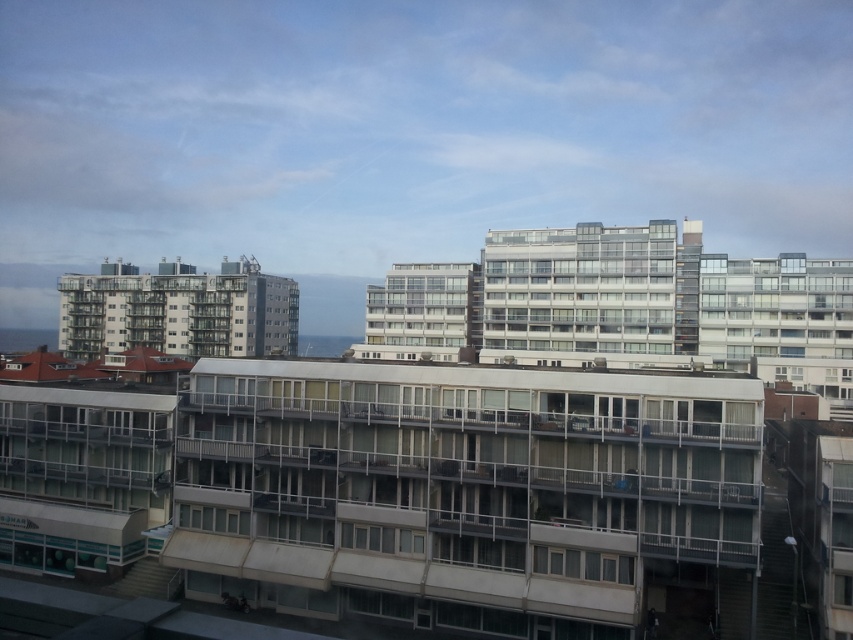
You are standing on the street in front of the residential area. You see the white concrete building at center and the matte glass building at left. Which building is closer to the ground?

The white concrete building at center is located below the matte glass building at left, so it is closer to the ground.

You are an urban planner evaluating this residential area. You need to determine which building, the white concrete building at center or the matte glass building at left, has a greater floor area. Based on the information provided, which one would you choose?

The matte glass building at left is larger than the white concrete building at center, so it likely has a greater floor area.

You are standing in the residential area and want to take a photo of the white concrete building at center and the matte glass building at left. Which building will appear larger in the photo?

The white concrete building at center appears larger in the photo because it is closer to you than the matte glass building at left, which is further away.